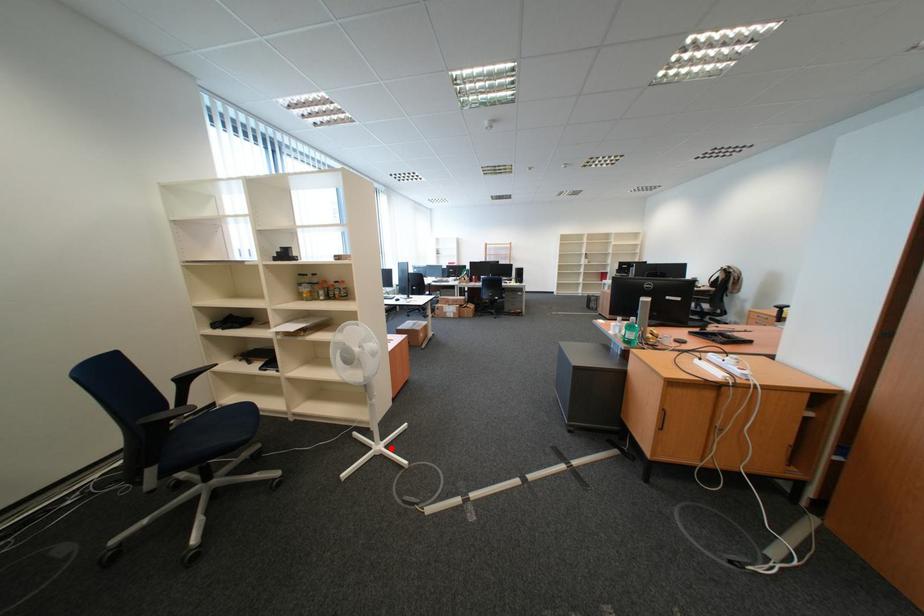
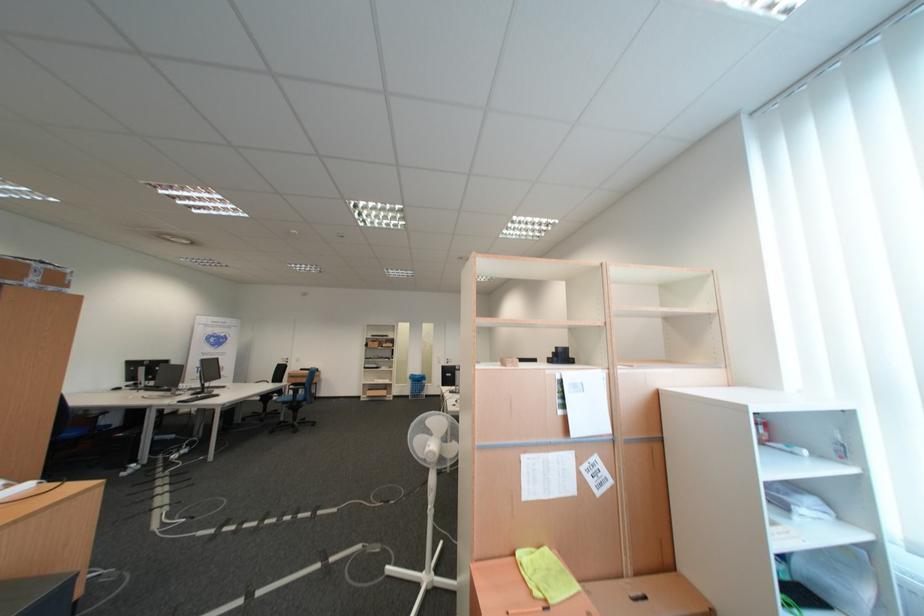
Find the pixel in the second image that matches the highlighted location in the first image.

(439, 578)